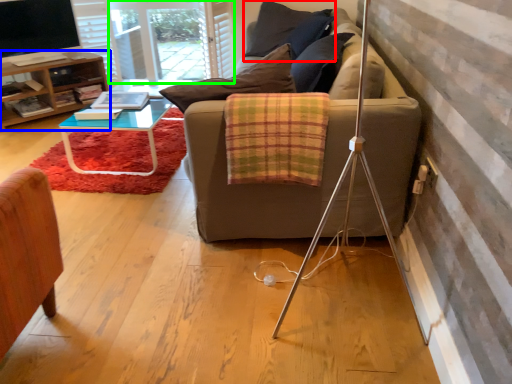
Question: Considering the real-world distances, which object is farthest from pillow (highlighted by a red box)? table (highlighted by a blue box) or screen door (highlighted by a green box)?

Choices:
 (A) table
 (B) screen door

Answer: (A)